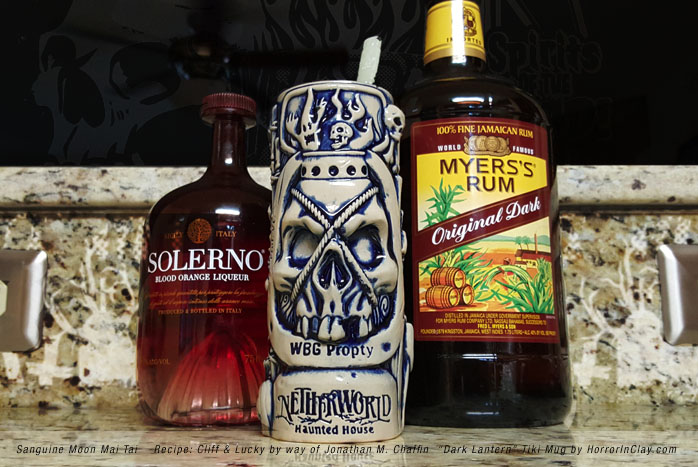
This screenshot has width=698, height=467. I want to click on electrical outlets, so click(x=671, y=301), click(x=31, y=319).